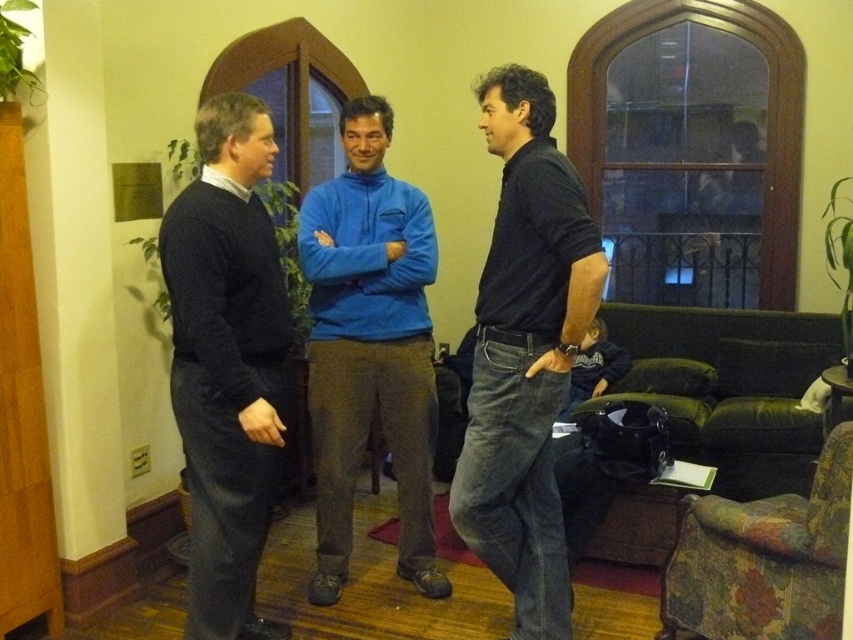
Question: Observing the image, what is the correct spatial positioning of dark blue sweater at left in reference to multicolored fabric armchair at lower right?

Choices:
 (A) above
 (B) below

Answer: (A)

Question: Which object is the closest to the dark blue sweater at left?

Choices:
 (A) multicolored fabric armchair at lower right
 (B) blue fleece jacket at center

Answer: (B)

Question: Can you confirm if dark blue sweater at left is bigger than multicolored fabric armchair at lower right?

Choices:
 (A) yes
 (B) no

Answer: (B)

Question: Estimate the real-world distances between objects in this image. Which object is farther from the blue fleece jacket at center?

Choices:
 (A) multicolored fabric armchair at lower right
 (B) dark blue jeans at center
 (C) dark blue sweater at left

Answer: (A)

Question: Which object is farther from the camera taking this photo?

Choices:
 (A) dark blue sweater at left
 (B) multicolored fabric armchair at lower right

Answer: (A)

Question: Observing the image, what is the correct spatial positioning of dark blue sweater at left in reference to blue fleece jacket at center?

Choices:
 (A) left
 (B) right

Answer: (A)